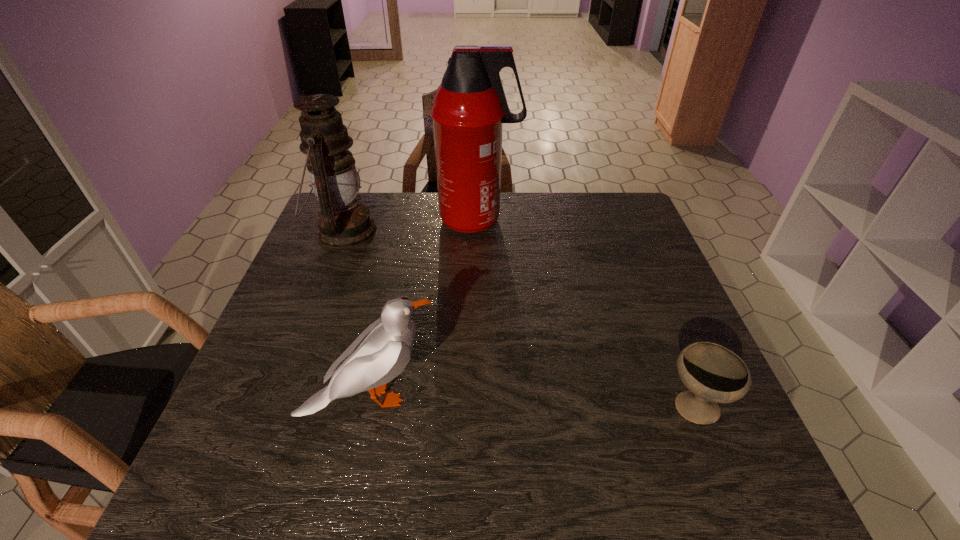
Find the location of a particular element. Image resolution: width=960 pixels, height=540 pixels. free region at the near right corner is located at coordinates (698, 482).

The height and width of the screenshot is (540, 960). What are the coordinates of `free spot between the fire extinguisher and the second tallest object` in the screenshot? It's located at (411, 226).

Locate an element on the screen. Image resolution: width=960 pixels, height=540 pixels. empty space that is in between the third shortest object and the tallest object is located at coordinates (411, 226).

Identify the location of free space between the gull and the lantern. (358, 314).

Where is `free space between the gull and the lantern`? This screenshot has width=960, height=540. free space between the gull and the lantern is located at coordinates (358, 314).

In order to click on unoccupied position between the gull and the shortest object in this screenshot , I will do `click(532, 402)`.

At what (x,y) coordinates should I click in order to perform the action: click on vacant point located between the third tallest object and the second tallest object. Please return your answer as a coordinate pair (x, y). Looking at the image, I should click on (358, 314).

The image size is (960, 540). Identify the location of vacant region between the chalice and the gull. (532, 402).

Find the location of a particular element. This screenshot has height=540, width=960. empty space that is in between the lantern and the tallest object is located at coordinates (411, 226).

The height and width of the screenshot is (540, 960). Identify the location of vacant space in between the fire extinguisher and the rightmost object. (586, 314).